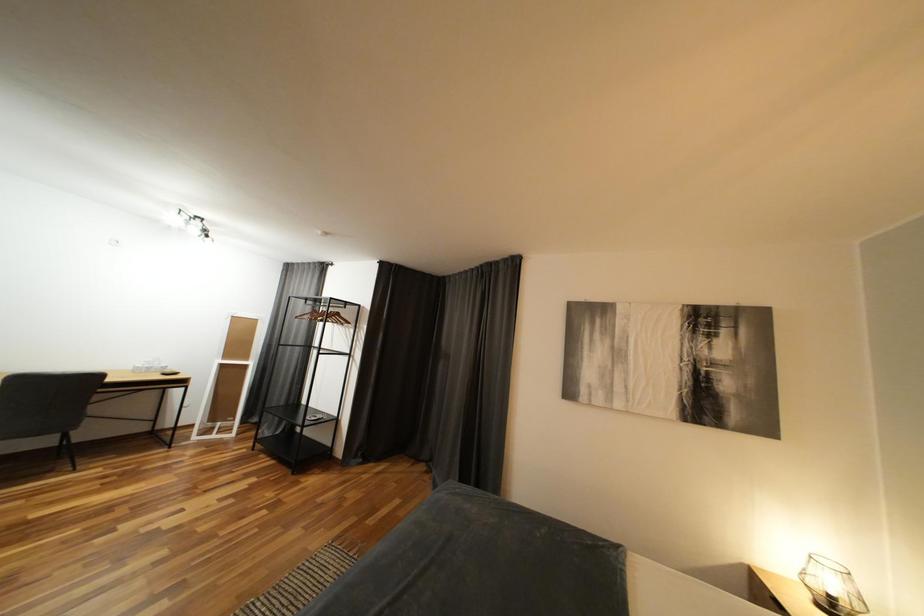
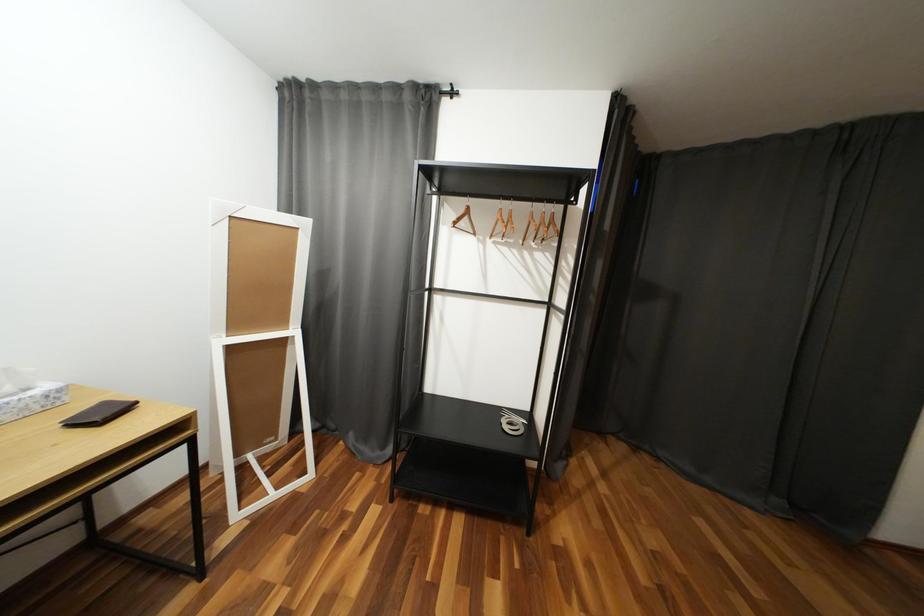
What movement of the cameraman would produce the second image?

The cameraman moved toward left, forward.